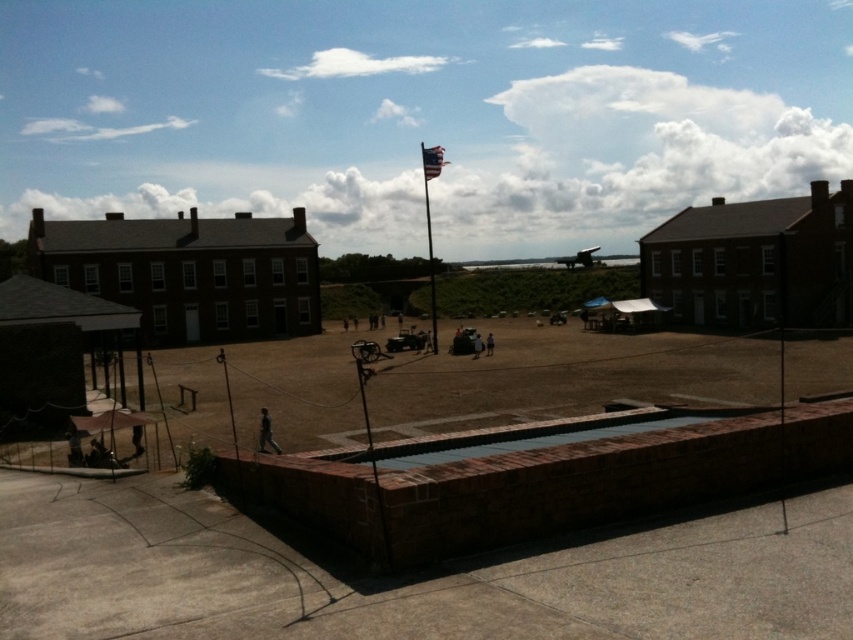
Question: Which point is closer to the camera?

Choices:
 (A) brown dirt field at center
 (B) metallic flagpole at upper center

Answer: (A)

Question: Does brown dirt field at center lie in front of metallic flagpole at upper center?

Choices:
 (A) yes
 (B) no

Answer: (A)

Question: Is brown dirt field at center thinner than metallic flagpole at upper center?

Choices:
 (A) yes
 (B) no

Answer: (B)

Question: Is brown dirt field at center thinner than metallic flagpole at upper center?

Choices:
 (A) yes
 (B) no

Answer: (B)